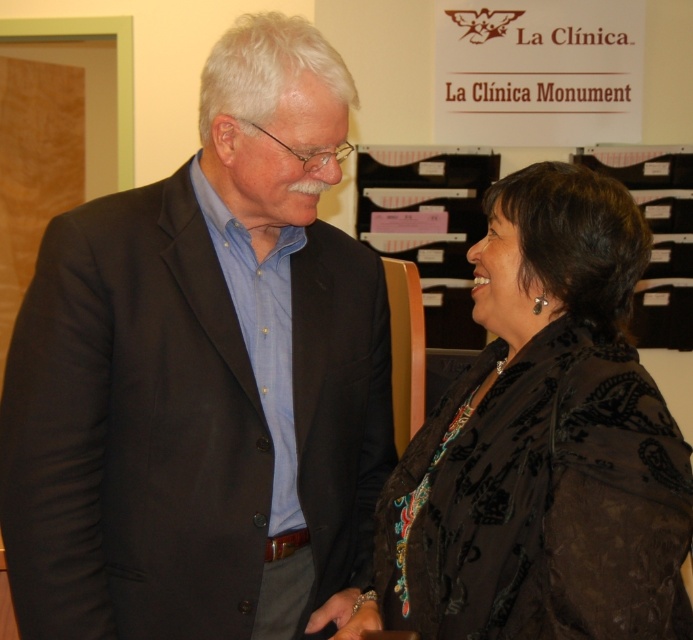
In the scene shown: You are a tailor who needs to determine which garment requires more fabric for alterations. Given the image of a matte black suit at center and a black velvet jacket at center, which one would need more fabric due to its larger size?

The matte black suit at center requires more fabric because its width surpasses that of the black velvet jacket at center.

You are an event planner arranging a meeting between two people. You need to seat them so that the person wearing the matte black suit at center is on the left side of the black velvet jacket at center. Based on the current arrangement, is this requirement already met?

Yes, the requirement is already met because the matte black suit at center is positioned to the left of the black velvet jacket at center.

You are a tailor standing 1.2 meters away from the matte black suit at center. You need to adjust the sleeves. Can you comfortably reach the sleeves from your current position?

The distance between you and the matte black suit at center is 1.21 meters. Since you are only 1.2 meters away, you are close enough to comfortably reach the sleeves for adjustments.